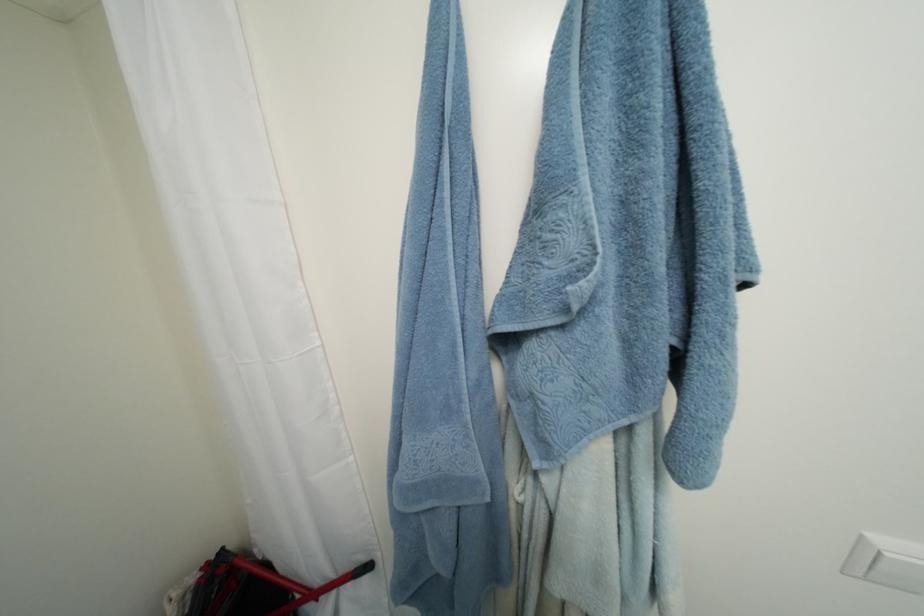
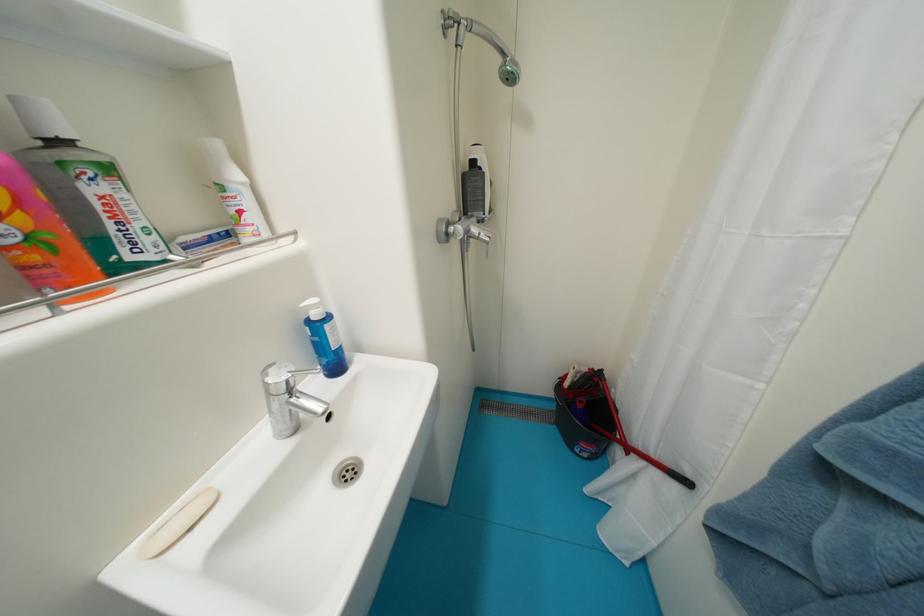
The first image is from the beginning of the video and the second image is from the end. How did the camera likely rotate when shooting the video?

The camera rotated toward left-down.